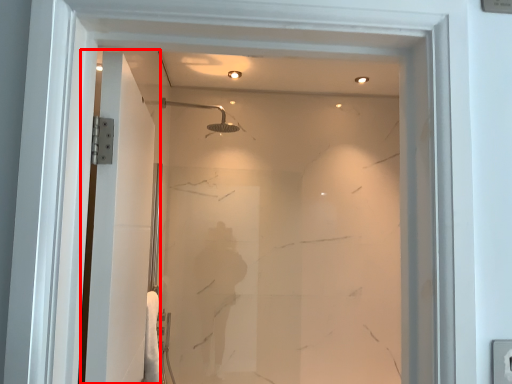
Question: From the image's perspective, what is the correct spatial positioning of screen door (annotated by the red box) in reference to shower?

Choices:
 (A) above
 (B) below

Answer: (B)